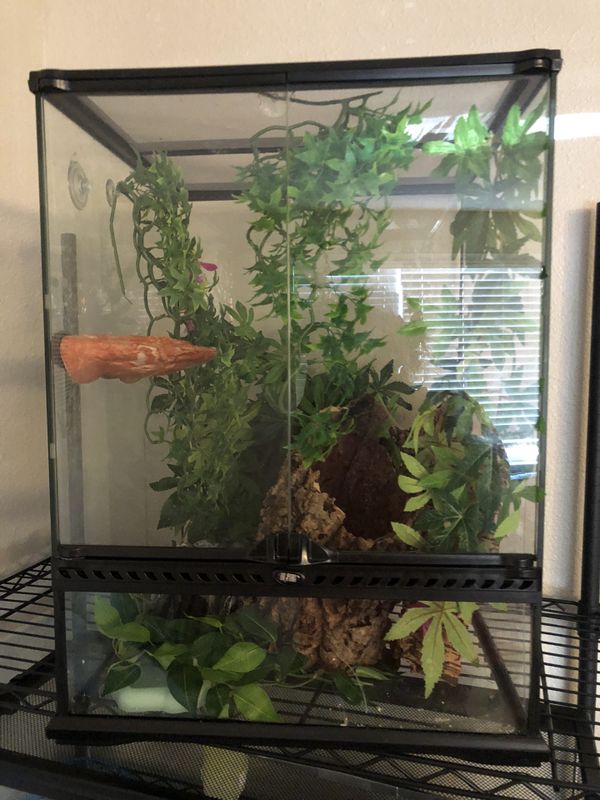
The height and width of the screenshot is (800, 600). In order to click on wall in this screenshot , I will do `click(14, 406)`.